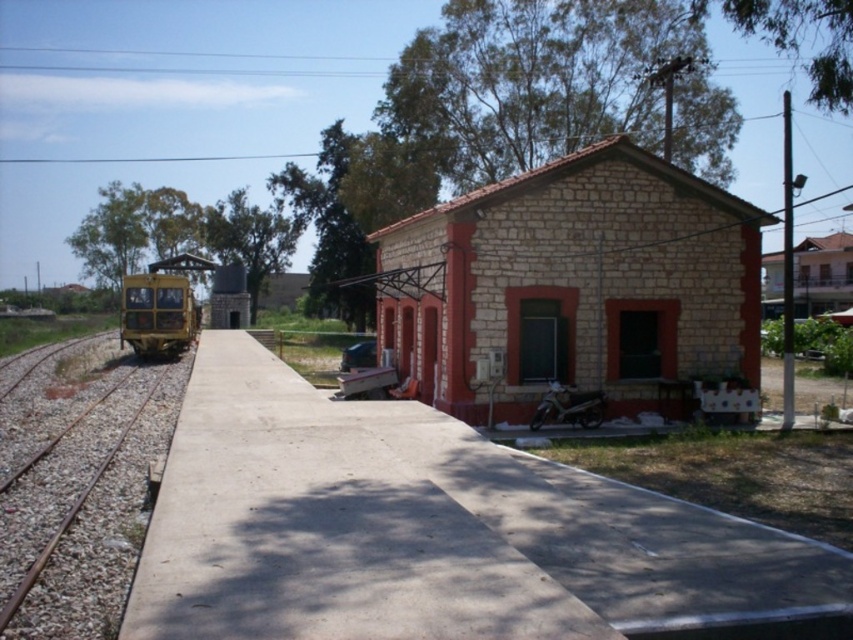
You are standing at the train station and want to take a photo of the two points mentioned. Which point, point (38, 476) or point (169, 339), will appear larger in your camera view?

Point (38, 476) is closer to the camera than point (169, 339), so it will appear larger in the camera view.